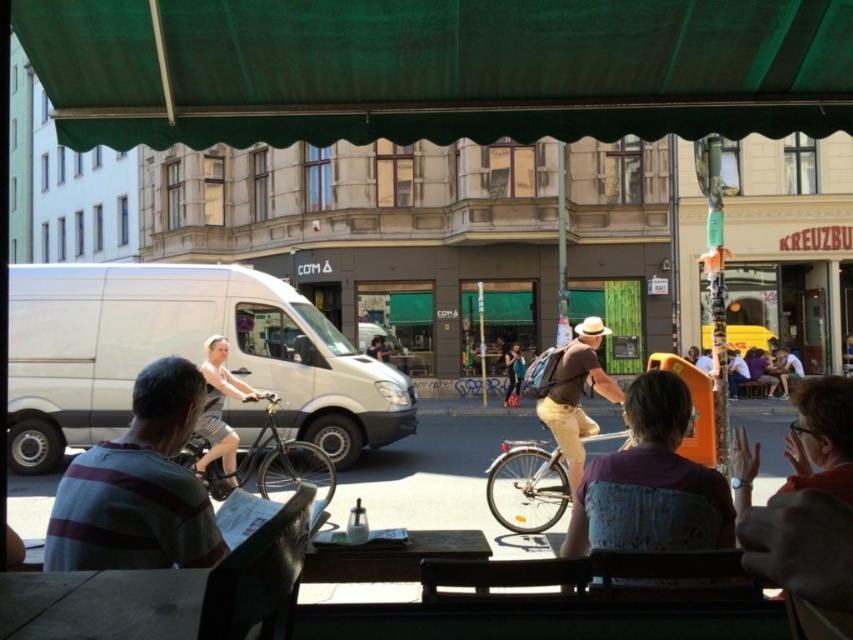
Question: Estimate the real-world distances between objects in this image. Which object is farther from the blue denim jeans at center?

Choices:
 (A) matte red shirt at upper right
 (B) brown cotton shirt at center
 (C) light brown leather jacket at center

Answer: (A)

Question: Can you confirm if light brown striped shirt at center is positioned to the left of blue denim jeans at center?

Choices:
 (A) no
 (B) yes

Answer: (B)

Question: Which of these objects is positioned closest to the light gray striped dress at center?

Choices:
 (A) light brown leather jacket at lower right
 (B) matte black bicycle at center

Answer: (B)

Question: Which of these objects is positioned farthest from the light brown leather jacket at center?

Choices:
 (A) wooden table at center
 (B) shiny silver bicycle at center
 (C) light gray striped dress at center
 (D) light brown striped shirt at center

Answer: (D)

Question: Can you confirm if wooden table at center is bigger than blue denim jeans at center?

Choices:
 (A) no
 (B) yes

Answer: (A)

Question: Can you confirm if wooden table at center is positioned above light gray striped dress at center?

Choices:
 (A) no
 (B) yes

Answer: (A)